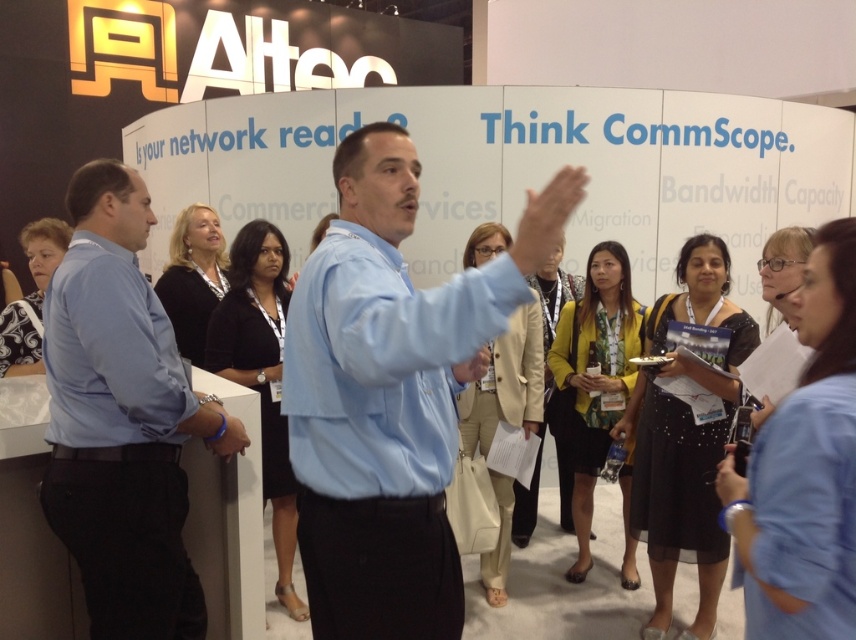
Question: Which of the following is the farthest from the observer?

Choices:
 (A) blue shirt at left
 (B) light blue shirt at center

Answer: (A)

Question: Can you confirm if light blue shirt at center is bigger than blue shirt at left?

Choices:
 (A) no
 (B) yes

Answer: (B)

Question: Is light blue shirt at center positioned behind blue shirt at left?

Choices:
 (A) no
 (B) yes

Answer: (A)

Question: Does light blue shirt at center appear on the left side of blue shirt at left?

Choices:
 (A) no
 (B) yes

Answer: (A)

Question: Which of the following is the closest to the observer?

Choices:
 (A) (x=366, y=131)
 (B) (x=80, y=456)

Answer: (A)

Question: Which of the following is the farthest from the observer?

Choices:
 (A) (560, 202)
 (B) (137, 420)

Answer: (B)